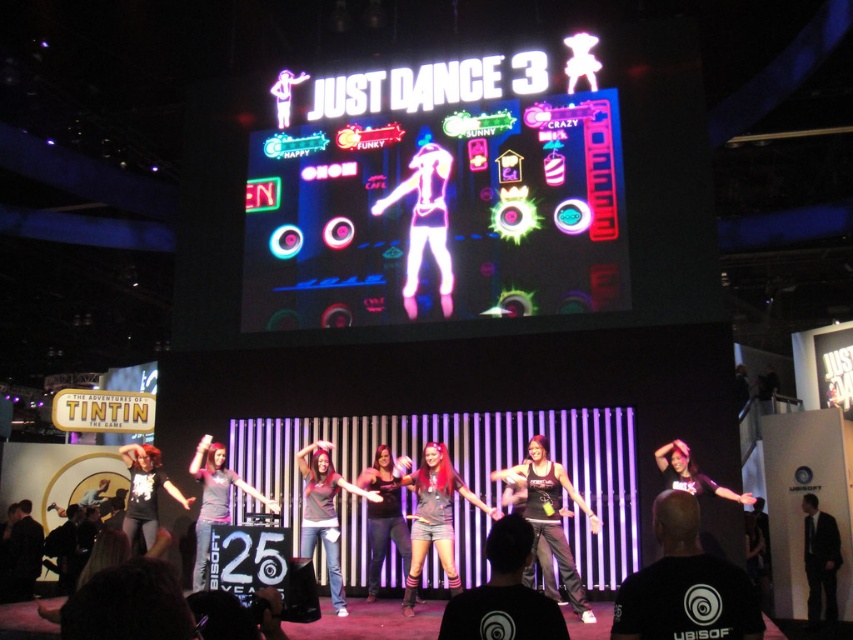
You are a photographer at the event and need to capture a photo of both the neon pink holographic dancer at center and the shiny black tank top at center without any obstructions. The camera you are using has a maximum focus range of 30 feet. Will you be able to capture both subjects clearly in the same frame?

The distance between the neon pink holographic dancer at center and the shiny black tank top at center is 31.27 feet, which exceeds the camera maximum focus range of 30 feet. Therefore, you won not be able to capture both subjects clearly in the same frame.

You are a photographer at the event and want to capture a photo of both the dark gray fabric shirt at center and the gray matte shirt at center. Since you want to focus on the wider one, which shirt should you adjust your camera to focus on?

The gray matte shirt at center is wider than the dark gray fabric shirt at center, so you should focus on the gray matte shirt at center.

Looking at this image, you are standing at the point marked as point (419,264) in the image. The screen displaying the title JUST DANCE 3 is directly behind you. If you want to move closer to the screen, which direction should you walk?

Since the point (419,264) is 38.65 meters away from the camera, moving towards the screen would require walking backward because the screen is behind you.